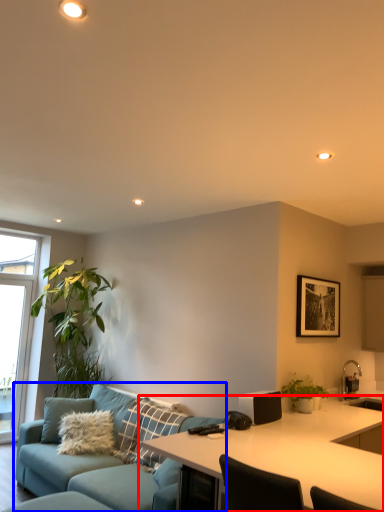
Question: Which point is closer to the camera, desk (highlighted by a red box) or studio couch (highlighted by a blue box)?

Choices:
 (A) desk
 (B) studio couch

Answer: (A)